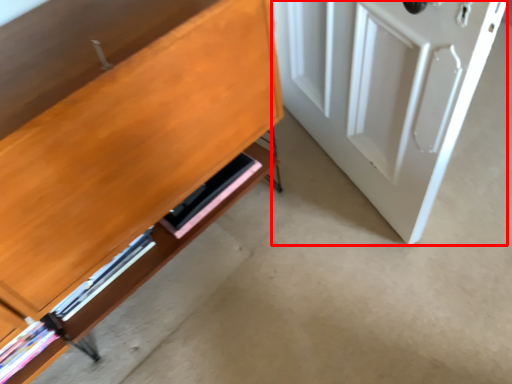
Question: From the image's perspective, considering the relative positions of door (annotated by the red box) and shelf in the image provided, where is door (annotated by the red box) located with respect to the staircase?

Choices:
 (A) above
 (B) below

Answer: (A)